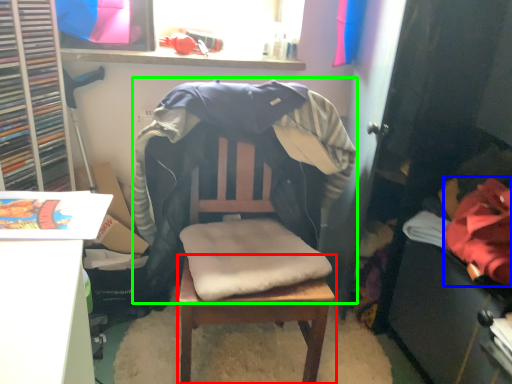
Question: Which object is the farthest from table (highlighted by a red box)? Choose among these: clothing (highlighted by a blue box) or bean bag chair (highlighted by a green box).

Choices:
 (A) clothing
 (B) bean bag chair

Answer: (A)